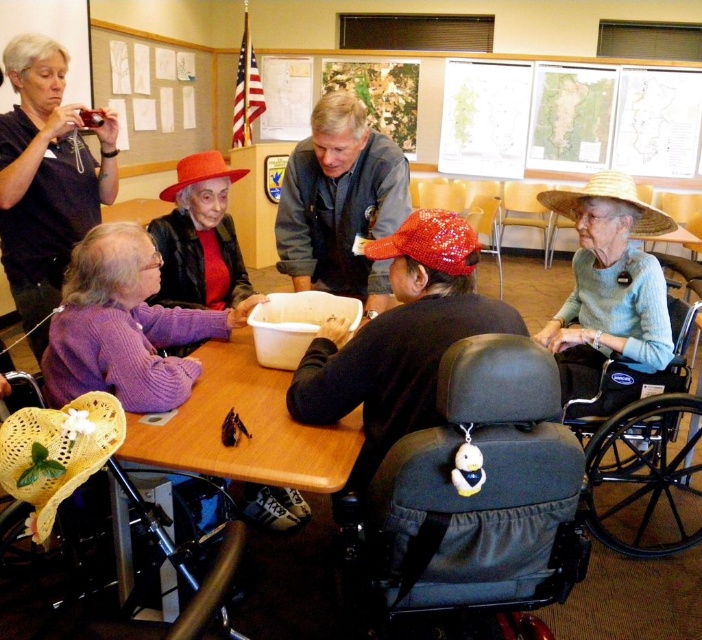
Can you confirm if black fabric camera at upper left is taller than black plastic wheelchair at lower right?

Correct, black fabric camera at upper left is much taller as black plastic wheelchair at lower right.

Which is in front, point (69, 198) or point (649, 465)?

Point (649, 465) is in front.

Where is `black fabric camera at upper left`? black fabric camera at upper left is located at coordinates (46, 176).

Is point (425, 445) closer to camera compared to point (574, 262)?

Yes, it is.

Between point (529, 557) and point (658, 275), which one is positioned in front?

Point (529, 557)

At what (x,y) coordinates should I click in order to perform the action: click on black fabric wheelchair at center. Please return your answer as a coordinate pair (x, y). Looking at the image, I should click on (476, 493).

Which of these two, wooden table at center or denim jacket at center, stands taller?

denim jacket at center

Which is in front, point (340, 442) or point (326, 100)?

Point (340, 442) is in front.

Where is `wooden table at center`? The image size is (702, 640). wooden table at center is located at coordinates (246, 428).